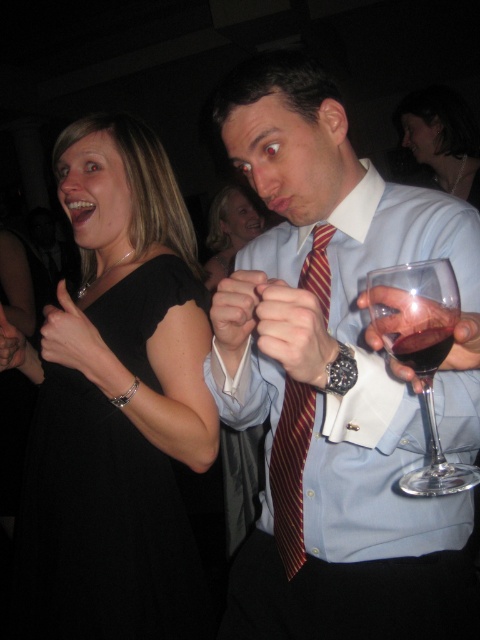
You are a photographer at this event and need to capture a closeup shot of both the matte blue shirt at center and the maroon striped tie at center in the same frame. Given that your camera lens has a maximum focus range of 4 inches, will you be able to achieve this?

The distance between the matte blue shirt at center and the maroon striped striped tie at center is 4.18 inches, which exceeds the camera lens maximum focus range of 4 inches. Therefore, you won be able to capture both in the same frame.

You are taking a photo of two points in the image. The first point is at coordinate point (133, 515) and the second point is at coordinate point (434, 365). Which point will appear closer to the camera in the photo?

Point (133, 515) is further to the camera than point (434, 365), so the first point will appear closer to the camera in the photo.